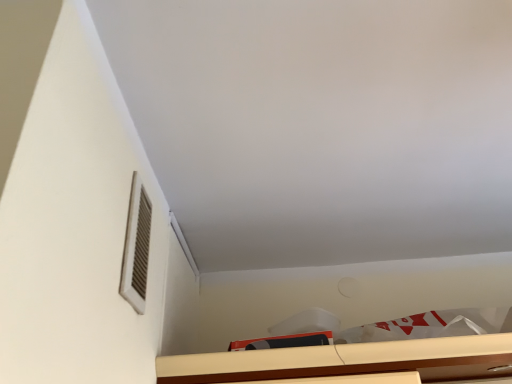
Question: Is white matte vent at upper left taller or shorter than wooden cabinet at lower center?

Choices:
 (A) short
 (B) tall

Answer: (B)

Question: Based on their sizes in the image, would you say white matte vent at upper left is bigger or smaller than wooden cabinet at lower center?

Choices:
 (A) big
 (B) small

Answer: (B)

Question: Is white matte vent at upper left in front of or behind wooden cabinet at lower center in the image?

Choices:
 (A) front
 (B) behind

Answer: (A)

Question: Is wooden cabinet at lower center bigger or smaller than white matte vent at upper left?

Choices:
 (A) small
 (B) big

Answer: (B)

Question: From the image's perspective, is wooden cabinet at lower center positioned above or below white matte vent at upper left?

Choices:
 (A) below
 (B) above

Answer: (A)

Question: Would you say wooden cabinet at lower center is to the left or to the right of white matte vent at upper left in the picture?

Choices:
 (A) left
 (B) right

Answer: (B)

Question: Considering the positions of wooden cabinet at lower center and white matte vent at upper left in the image, is wooden cabinet at lower center taller or shorter than white matte vent at upper left?

Choices:
 (A) short
 (B) tall

Answer: (A)